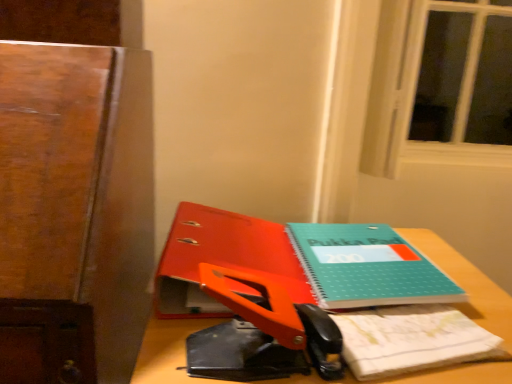
Where is `space that is in front of teal matte notebook at center`? space that is in front of teal matte notebook at center is located at coordinates (416, 343).